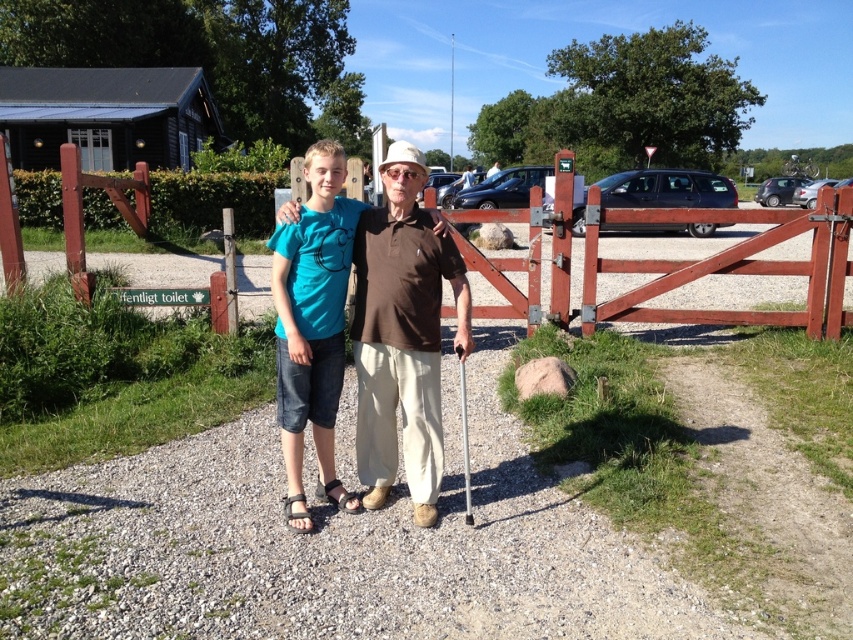
Question: Is wooden gate at center above teal cotton t-shirt at center?

Choices:
 (A) yes
 (B) no

Answer: (A)

Question: Can you confirm if wooden gate at center is positioned below teal cotton t-shirt at center?

Choices:
 (A) no
 (B) yes

Answer: (A)

Question: Which object appears farthest from the camera in this image?

Choices:
 (A) teal cotton t-shirt at center
 (B) wooden gate at center

Answer: (B)

Question: Can you confirm if wooden gate at center is positioned above teal cotton t-shirt at center?

Choices:
 (A) yes
 (B) no

Answer: (A)

Question: Which object appears farthest from the camera in this image?

Choices:
 (A) wooden gate at center
 (B) teal cotton t-shirt at center

Answer: (A)

Question: Which point appears closest to the camera in this image?

Choices:
 (A) (422, 442)
 (B) (747, 256)

Answer: (A)